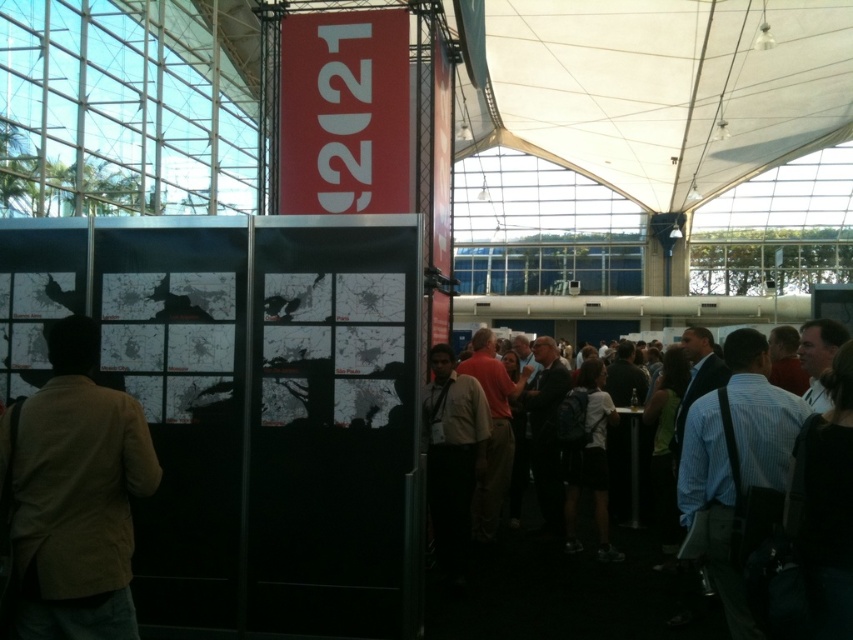
Question: Can you confirm if light brown textured blazer at left is positioned to the right of blue striped shirt at right?

Choices:
 (A) yes
 (B) no

Answer: (B)

Question: Does white fabric canopy at upper center appear on the left side of dark clothing crowd at lower right?

Choices:
 (A) no
 (B) yes

Answer: (A)

Question: Which object is positioned farthest from the blue striped shirt at right?

Choices:
 (A) light brown textured blazer at left
 (B) white fabric canopy at upper center

Answer: (B)

Question: Which object is the farthest from the white fabric canopy at upper center?

Choices:
 (A) light brown textured blazer at left
 (B) blue striped shirt at right
 (C) dark clothing crowd at lower right

Answer: (B)

Question: From the image, what is the correct spatial relationship of white fabric canopy at upper center in relation to dark clothing crowd at lower right?

Choices:
 (A) below
 (B) above

Answer: (B)

Question: Estimate the real-world distances between objects in this image. Which object is closer to the white fabric canopy at upper center?

Choices:
 (A) blue striped shirt at right
 (B) dark clothing crowd at lower right

Answer: (B)